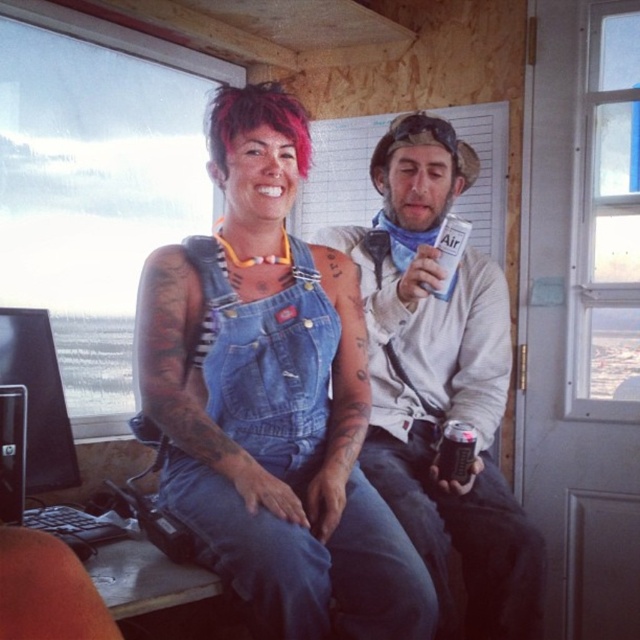
Question: Can you confirm if denim overalls at center is smaller than denim jacket at center?

Choices:
 (A) no
 (B) yes

Answer: (B)

Question: Is denim jacket at center bigger than orange matte keyboard at lower left?

Choices:
 (A) no
 (B) yes

Answer: (B)

Question: Which point is closer to the camera taking this photo?

Choices:
 (A) (292, 144)
 (B) (307, 358)
 (C) (387, 291)
 (D) (52, 598)

Answer: (D)

Question: Among these points, which one is nearest to the camera?

Choices:
 (A) (16, 577)
 (B) (385, 248)
 (C) (236, 102)
 (D) (244, 102)

Answer: (A)

Question: Which object is farther from the camera taking this photo?

Choices:
 (A) denim jacket at center
 (B) denim overalls at center
 (C) orange matte keyboard at lower left
 (D) pink dyed hair at upper center

Answer: (A)

Question: Can you confirm if denim jacket at center is bigger than pink dyed hair at upper center?

Choices:
 (A) yes
 (B) no

Answer: (A)